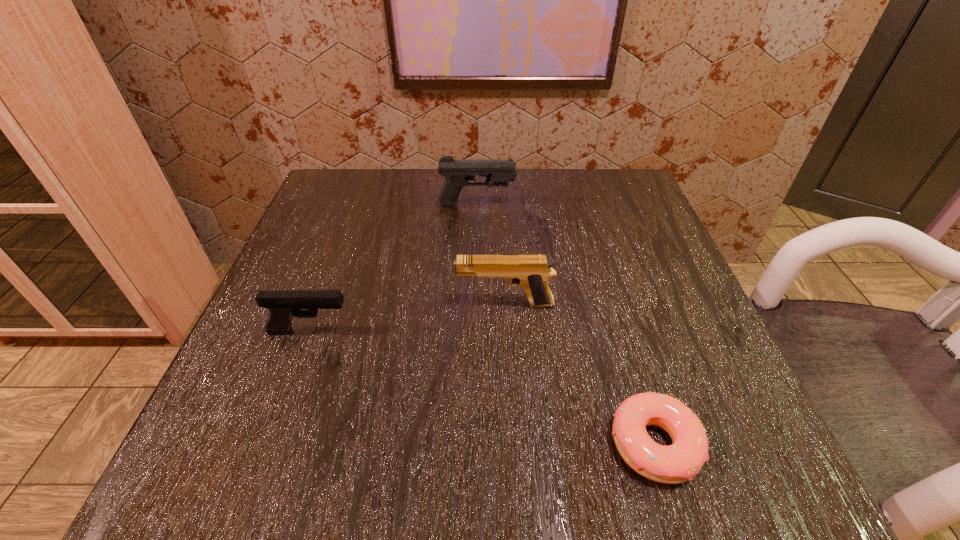
The image size is (960, 540). What are the coordinates of `free spot located 0.290m on the front-facing side of the shortest pistol` in the screenshot? It's located at (531, 332).

Identify the location of vacant space located on the left of the rightmost object. Image resolution: width=960 pixels, height=540 pixels. (396, 444).

Identify the location of object that is at the far edge. (457, 172).

Identify the location of object located in the near edge section of the desktop. This screenshot has height=540, width=960. (677, 463).

Locate an element on the screen. object at the left edge is located at coordinates (283, 304).

Image resolution: width=960 pixels, height=540 pixels. What are the coordinates of `object at the right edge` in the screenshot? It's located at (677, 463).

This screenshot has width=960, height=540. Identify the location of object that is at the near right corner. (677, 463).

Locate an element on the screen. The width and height of the screenshot is (960, 540). vacant area at the far edge of the desktop is located at coordinates (413, 176).

In the image, there is a desktop. Where is `blank space at the near edge`? This screenshot has height=540, width=960. blank space at the near edge is located at coordinates (x=538, y=484).

In the image, there is a desktop. Identify the location of vacant space at the left edge. Image resolution: width=960 pixels, height=540 pixels. click(340, 362).